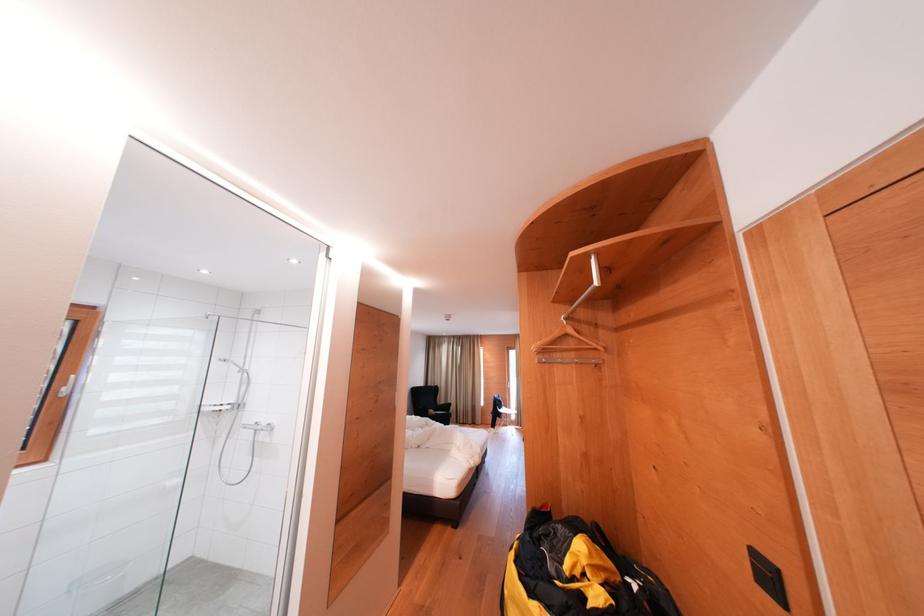
Identify the location of wooden clothes hanger. The width and height of the screenshot is (924, 616). (573, 330).